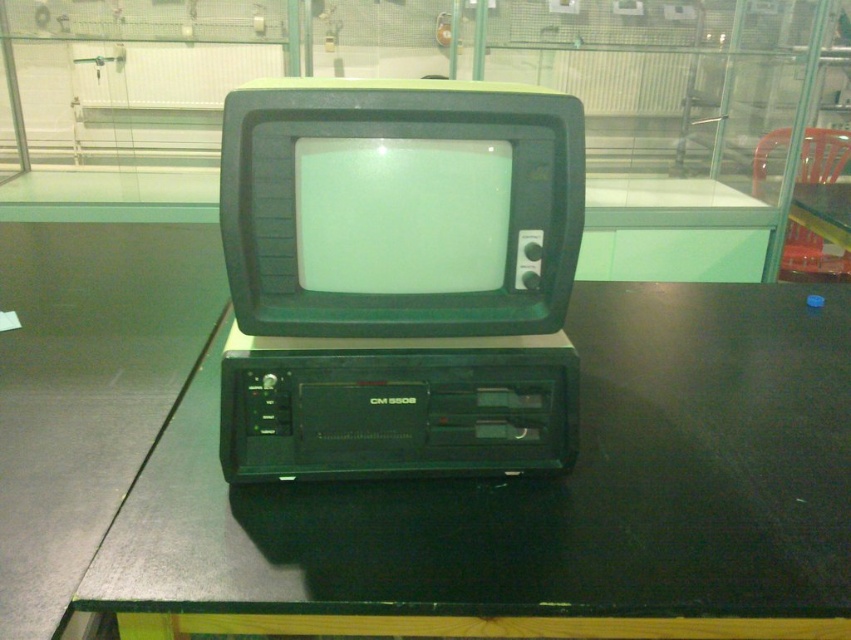
Question: Can you confirm if black glossy table at center is positioned to the right of green matte crt monitor at center?

Choices:
 (A) no
 (B) yes

Answer: (B)

Question: Which object appears closest to the camera in this image?

Choices:
 (A) green matte crt monitor at center
 (B) black glossy table at center

Answer: (B)

Question: Does black glossy table at center have a lesser width compared to green matte crt monitor at center?

Choices:
 (A) yes
 (B) no

Answer: (B)

Question: From the image, what is the correct spatial relationship of black glossy table at center in relation to green matte crt monitor at center?

Choices:
 (A) above
 (B) below

Answer: (B)

Question: Which of the following is the farthest from the observer?

Choices:
 (A) black glossy table at center
 (B) green matte crt monitor at center

Answer: (B)

Question: Which object is closer to the camera taking this photo?

Choices:
 (A) green matte crt monitor at center
 (B) black glossy table at center

Answer: (B)